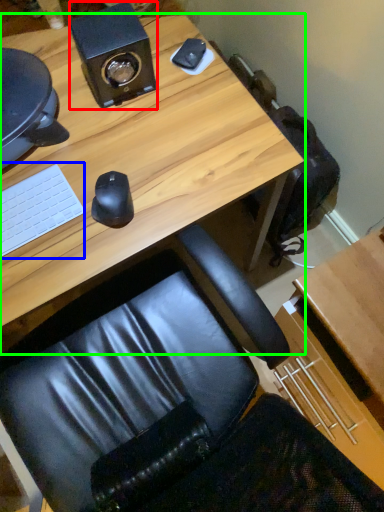
Question: Which object is positioned closest to speaker (highlighted by a red box)? Select from laptop keyboard (highlighted by a blue box) and desk (highlighted by a green box).

Choices:
 (A) laptop keyboard
 (B) desk

Answer: (B)